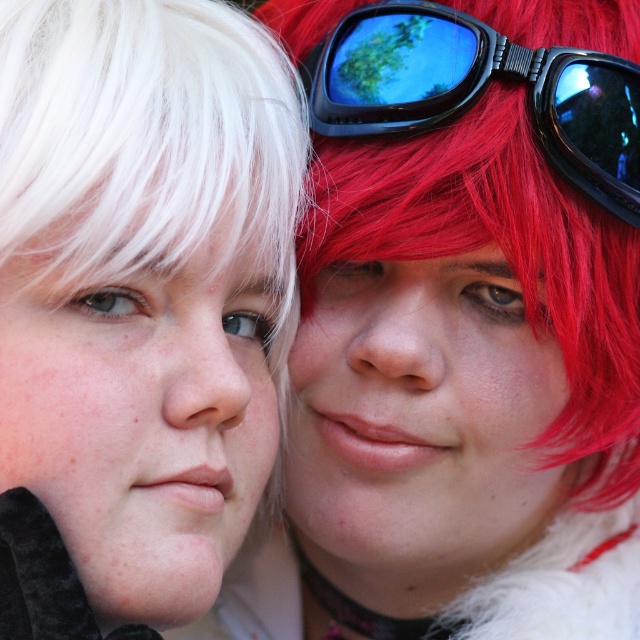
You are a hairstylist preparing to style a client. You have two wigs on a stand in front of you, a shiny red wig at center and a white matte wig at left. Your client wants to know which wig is closer to the center of the stand. Can you determine this based on their positions?

The shiny red wig at center is closer to the center of the stand than the white matte wig at left since they are 7.94 inches apart.

You are a photographer setting up a shot with the two people in the image. You need to ensure that the shiny red wig at center and the black glossy goggles at upper right are both visible in the frame. Given their sizes, which object should you prioritize keeping in the frame to avoid cropping?

The shiny red wig at center is wider than the black glossy goggles at upper right, so you should prioritize keeping the shiny red wig at center in the frame to avoid cropping since it takes up more space.

Consider the image. You are a photographer adjusting the camera settings to capture a closeup shot of the shiny red wig at center and the black glossy goggles at upper right. The camera has a focus range that can only handle objects within 5 inches of each other. Will both objects stay in focus?

The shiny red wig at center and black glossy goggles at upper right are 4.76 inches apart from each other, which is within the camera focus range of 5 inches. Therefore, both objects will stay in focus.